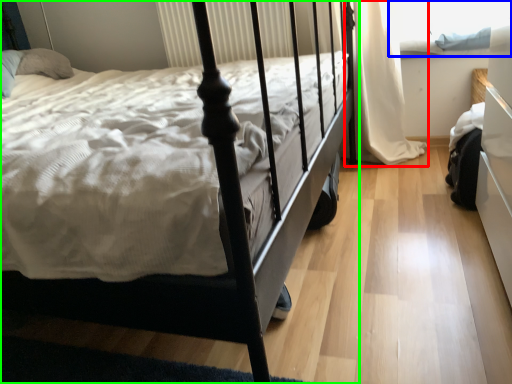
Question: Which object is positioned closest to curtain (highlighted by a red box)? Select from window screen (highlighted by a blue box) and bed (highlighted by a green box).

Choices:
 (A) window screen
 (B) bed

Answer: (A)